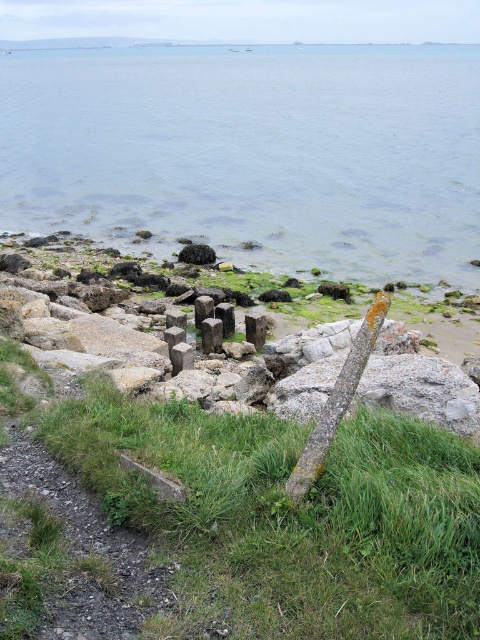
Based on the photo, which of these two, clear water at lower center or green grass at lower center, stands taller?

Standing taller between the two is clear water at lower center.

Is clear water at lower center smaller than green grass at lower center?

Incorrect, clear water at lower center is not smaller in size than green grass at lower center.

Describe the element at coordinates (253, 154) in the screenshot. The width and height of the screenshot is (480, 640). I see `clear water at lower center` at that location.

This screenshot has width=480, height=640. Find the location of `clear water at lower center`. clear water at lower center is located at coordinates (253, 154).

Is green grass at lower center positioned behind brown mossy pole at center?

No, it is in front of brown mossy pole at center.

Between point (476, 445) and point (324, 424), which one is positioned behind?

The point (476, 445) is behind.

The height and width of the screenshot is (640, 480). Describe the element at coordinates (290, 515) in the screenshot. I see `green grass at lower center` at that location.

Image resolution: width=480 pixels, height=640 pixels. I want to click on green grass at lower center, so click(x=290, y=515).

The width and height of the screenshot is (480, 640). Describe the element at coordinates (253, 154) in the screenshot. I see `clear water at lower center` at that location.

Can you confirm if clear water at lower center is wider than brown mossy pole at center?

Yes, clear water at lower center is wider than brown mossy pole at center.

This screenshot has height=640, width=480. Find the location of `clear water at lower center`. clear water at lower center is located at coordinates (253, 154).

I want to click on clear water at lower center, so click(253, 154).